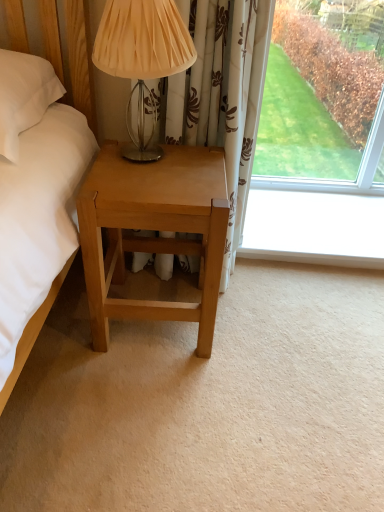
Locate an element on the screen. This screenshot has height=512, width=384. free location in front of matte beige fabric at upper center is located at coordinates (143, 183).